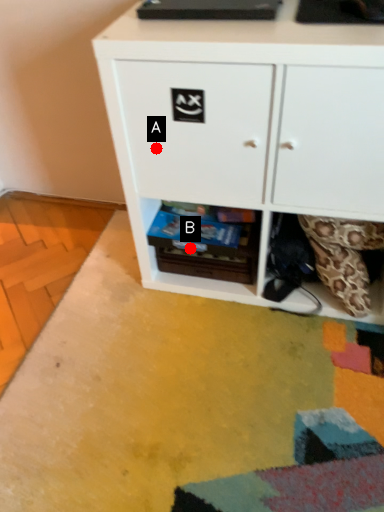
Question: Two points are circled on the image, labeled by A and B beside each circle. Among these points, which one is nearest to the camera?

Choices:
 (A) A is closer
 (B) B is closer

Answer: (A)